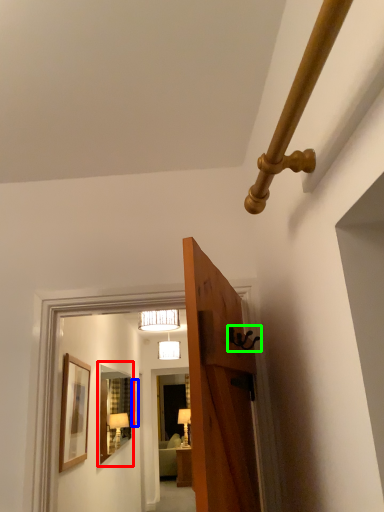
Question: Based on their relative distances, which object is nearer to mirror (highlighted by a red box)? Choose from picture frame (highlighted by a blue box) and door handle (highlighted by a green box).

Choices:
 (A) picture frame
 (B) door handle

Answer: (A)